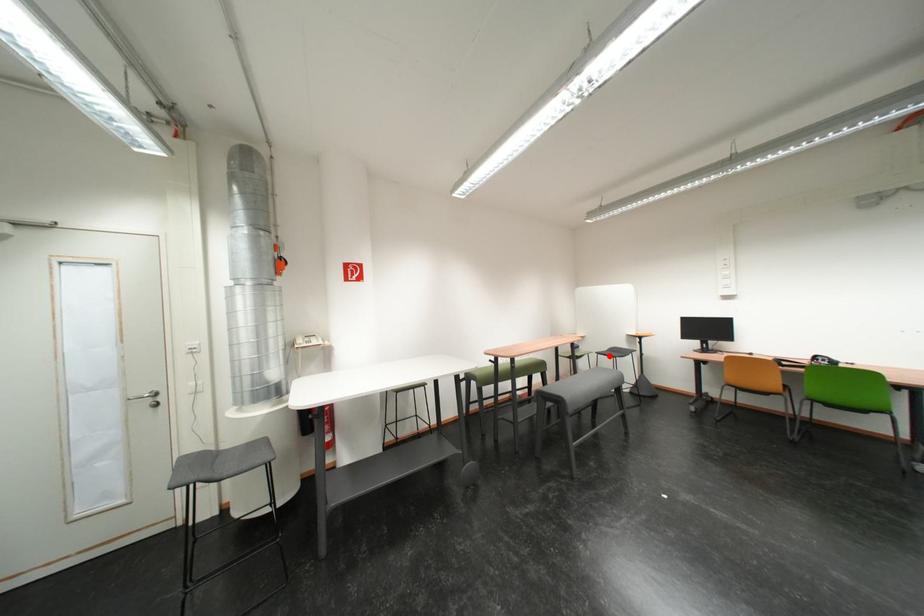
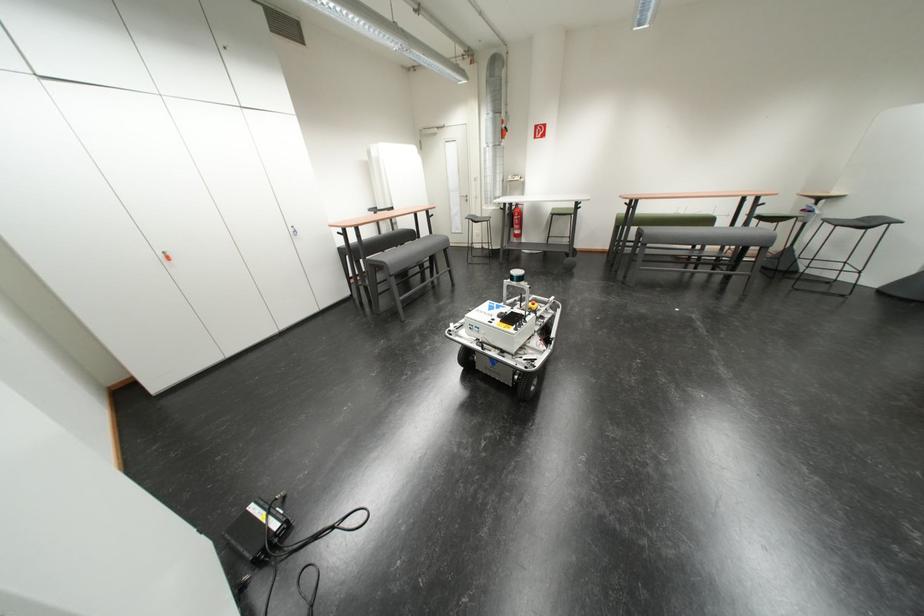
Find the pixel in the second image that matches the highlighted location in the first image.

(837, 223)